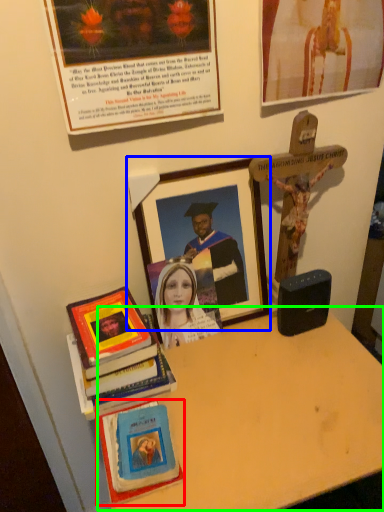
Question: Which object is positioned closest to book (highlighted by a red box)? Select from picture frame (highlighted by a blue box) and table (highlighted by a green box).

Choices:
 (A) picture frame
 (B) table

Answer: (B)